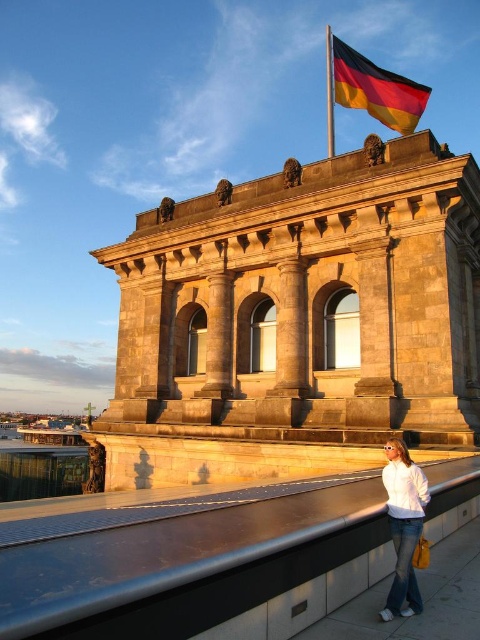
Question: Does metallic gray balustrade at lower center have a smaller size compared to polished fabric flag at upper center?

Choices:
 (A) no
 (B) yes

Answer: (B)

Question: Does metallic gray balustrade at lower center have a larger size compared to white matte shirt at lower right?

Choices:
 (A) no
 (B) yes

Answer: (B)

Question: Which point is closer to the camera?

Choices:
 (A) white matte shirt at lower right
 (B) metallic gray balustrade at lower center
 (C) polished fabric flag at upper center

Answer: (B)

Question: Among these points, which one is farthest from the camera?

Choices:
 (A) (374, 109)
 (B) (110, 604)
 (C) (417, 516)

Answer: (A)

Question: Which of the following is the farthest from the observer?

Choices:
 (A) (386, 74)
 (B) (420, 524)

Answer: (A)

Question: Is metallic gray balustrade at lower center smaller than white matte shirt at lower right?

Choices:
 (A) no
 (B) yes

Answer: (A)